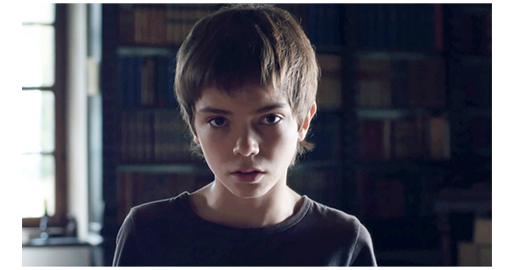
Locate an element on the screen. bookcase is located at coordinates (143, 127).